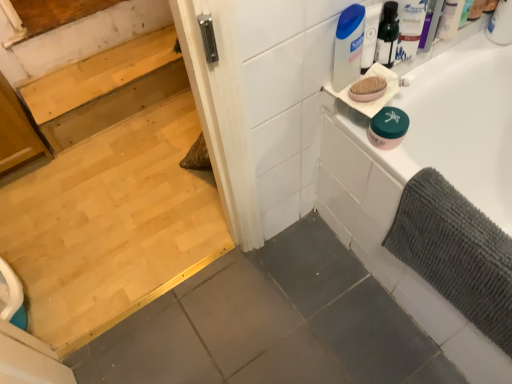
Question: Looking at the image, does white plastic container at upper right seem bigger or smaller compared to white plastic container at upper right?

Choices:
 (A) small
 (B) big

Answer: (B)

Question: Is point (352, 72) closer or farther from the camera than point (443, 26)?

Choices:
 (A) closer
 (B) farther

Answer: (A)

Question: Which object is positioned closest to the gray textured bath mat at right?

Choices:
 (A) white glossy bathtub at upper right
 (B) white plastic container at upper right
 (C) light brown wood stairs at upper left
 (D) green matte jar at upper right
 (E) pink matte oval soap at upper right

Answer: (A)

Question: Which of these objects is positioned farthest from the light brown wood stairs at upper left?

Choices:
 (A) white plastic container at upper right
 (B) white glossy bathtub at upper right
 (C) white plastic container at upper right
 (D) pink matte oval soap at upper right
 (E) gray textured bath mat at right

Answer: (E)